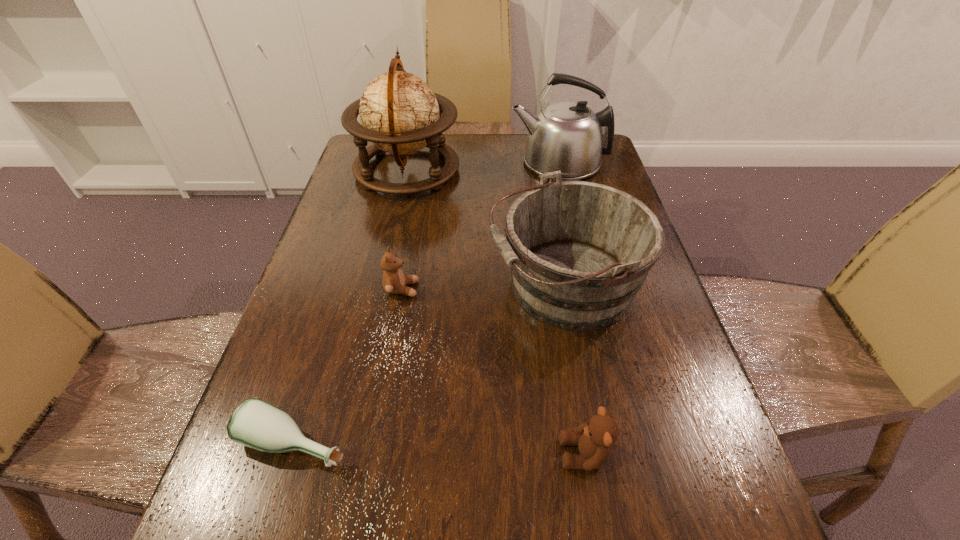
Where is `the tallest object`? the tallest object is located at coordinates (399, 113).

The width and height of the screenshot is (960, 540). What are the coordinates of `the second tallest object` in the screenshot? It's located at (566, 136).

The height and width of the screenshot is (540, 960). What are the coordinates of `wine bucket` in the screenshot? It's located at (579, 252).

You are a GUI agent. You are given a task and a screenshot of the screen. Output one action in this format:
    pyautogui.click(x=<x>, y=<y>)
    Task: Click on the farther teddy bear
    This screenshot has width=960, height=540.
    Given the screenshot: What is the action you would take?
    pyautogui.click(x=394, y=282)

Identify the location of the right teddy bear. (594, 439).

You are a GUI agent. You are given a task and a screenshot of the screen. Output one action in this format:
    pyautogui.click(x=<x>, y=<y>)
    Task: Click on the shortest object
    
    Given the screenshot: What is the action you would take?
    pyautogui.click(x=255, y=423)

Find the location of a particular element. Image resolution: width=960 pixels, height=540 pixels. free point located 0.070m on the right of the tallest object is located at coordinates (483, 171).

Find the location of a particular element. The image size is (960, 540). vacant space located on the spout of the kettle is located at coordinates (467, 163).

Where is `free region located 0.140m on the spout of the kettle`? Image resolution: width=960 pixels, height=540 pixels. free region located 0.140m on the spout of the kettle is located at coordinates (464, 163).

At what (x,y) coordinates should I click in order to perform the action: click on free spot located on the spout of the kettle. Please return your answer as a coordinate pair (x, y). Looking at the image, I should click on (415, 163).